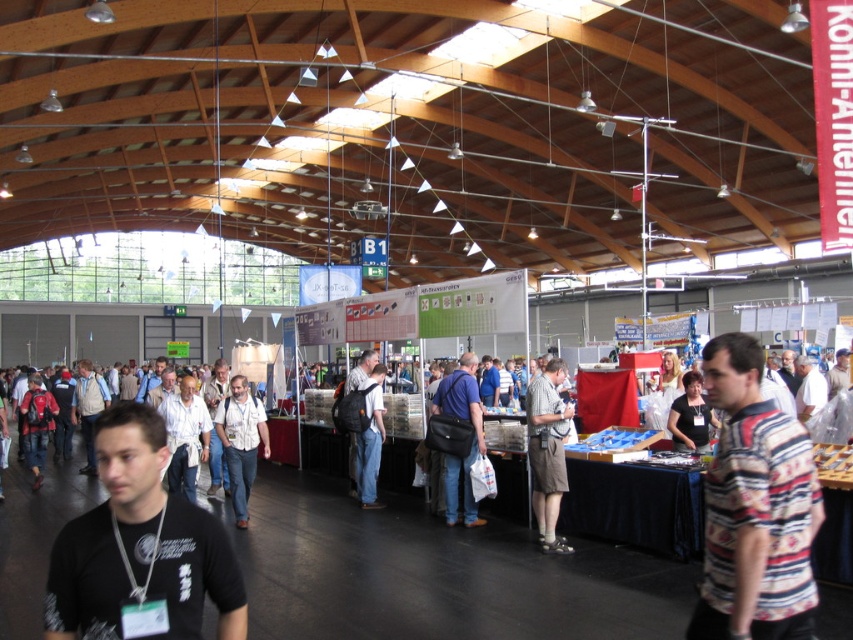
How much distance is there between black matte t-shirt at lower left and dark blue jeans at center?

black matte t-shirt at lower left and dark blue jeans at center are 26.03 feet apart.

Is black matte t-shirt at lower left further to the viewer compared to dark blue jeans at center?

That is False.

Which is behind, point (109, 483) or point (364, 372)?

The point (364, 372) is behind.

Locate an element on the screen. black matte t-shirt at lower left is located at coordinates 140,548.

Can you confirm if black matte t-shirt at lower left is shorter than white shirt at center?

Yes, black matte t-shirt at lower left is shorter than white shirt at center.

Does point (155, 536) lie in front of point (257, 412)?

Yes, point (155, 536) is closer to viewer.

Where is `black matte t-shirt at lower left`? This screenshot has width=853, height=640. black matte t-shirt at lower left is located at coordinates (140, 548).

Does white shirt at center have a greater height compared to dark blue shirt at center?

Correct, white shirt at center is much taller as dark blue shirt at center.

Between white shirt at center and dark blue shirt at center, which one has less height?

dark blue shirt at center

This screenshot has width=853, height=640. What do you see at coordinates (241, 442) in the screenshot?
I see `white shirt at center` at bounding box center [241, 442].

What are the coordinates of `white shirt at center` in the screenshot? It's located at (241, 442).